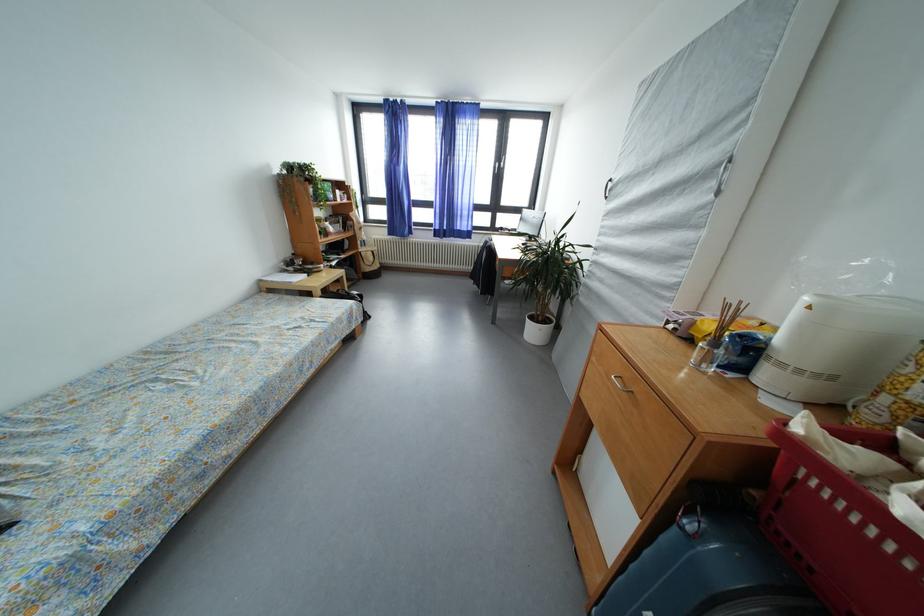
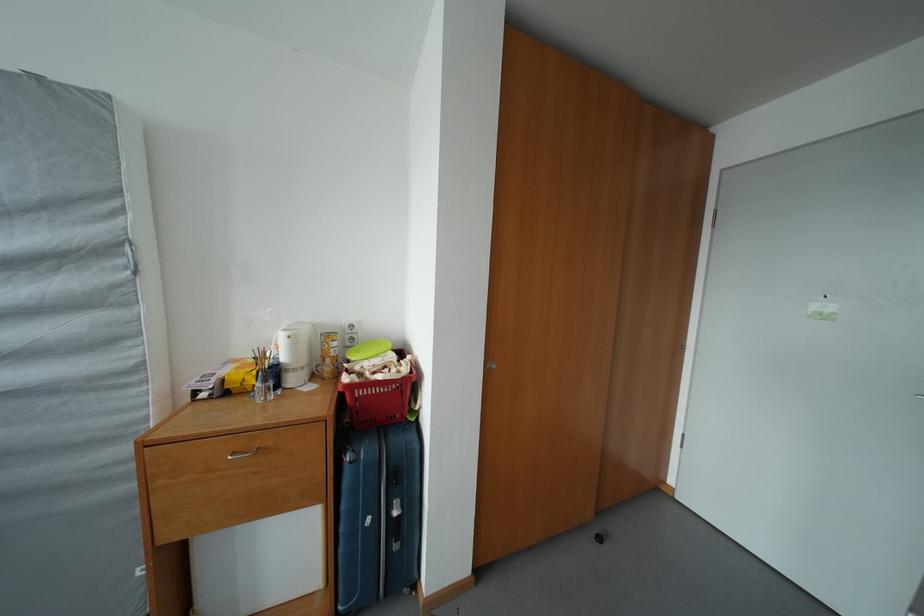
How did the camera likely rotate?

The camera rotated toward right-down.